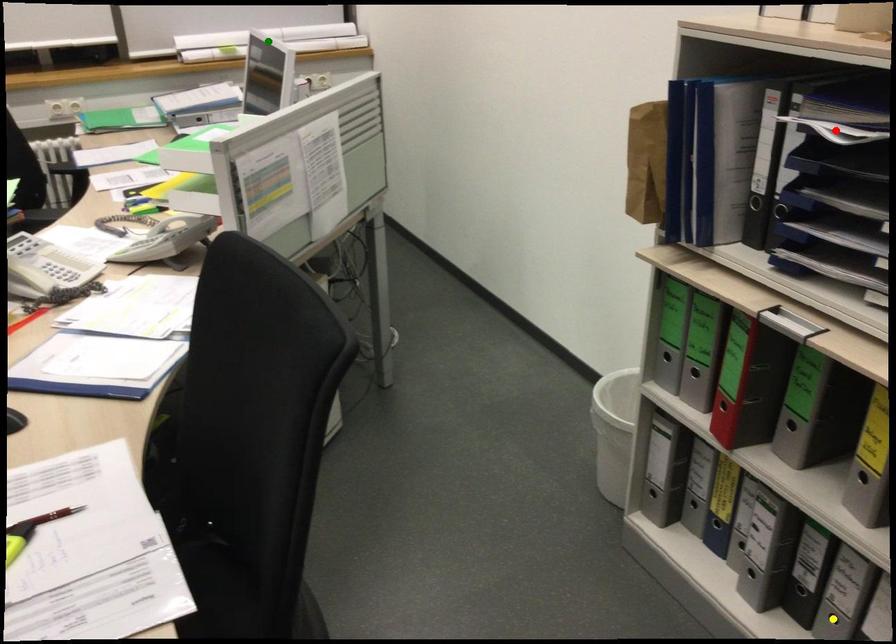
Order these from nearest to farthest:
A) yellow point
B) red point
C) green point

1. green point
2. yellow point
3. red point